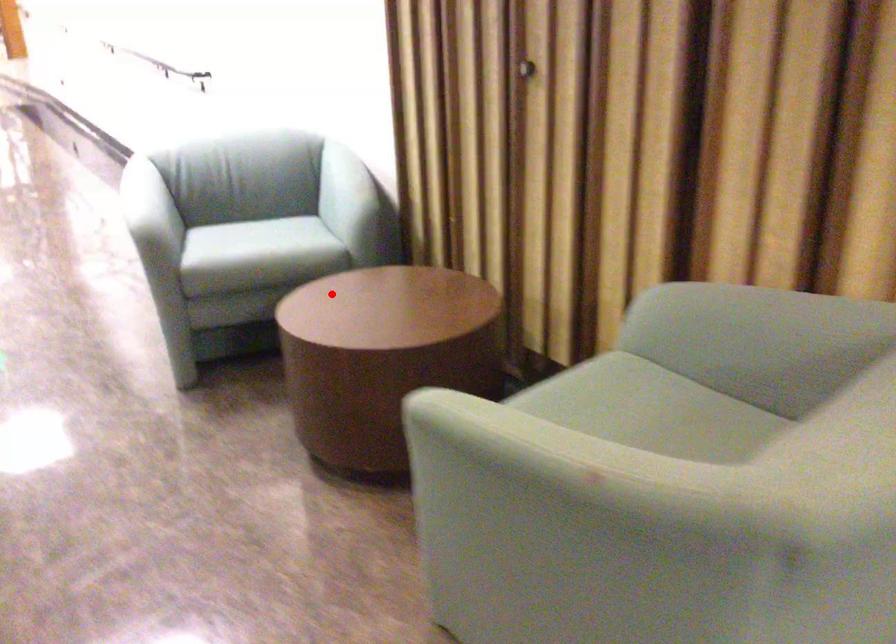
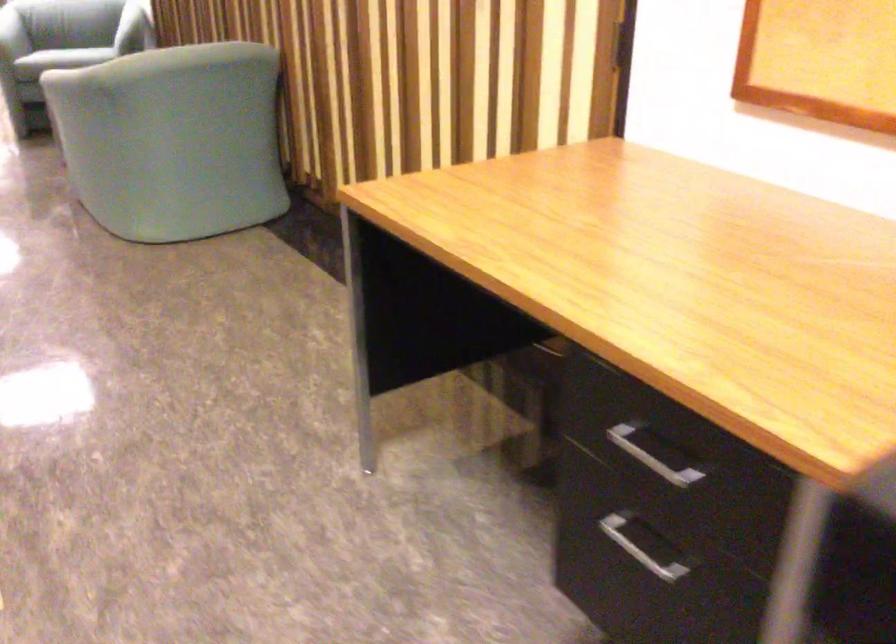
Find the pixel in the second image that matches the highlighted location in the first image.

(66, 57)